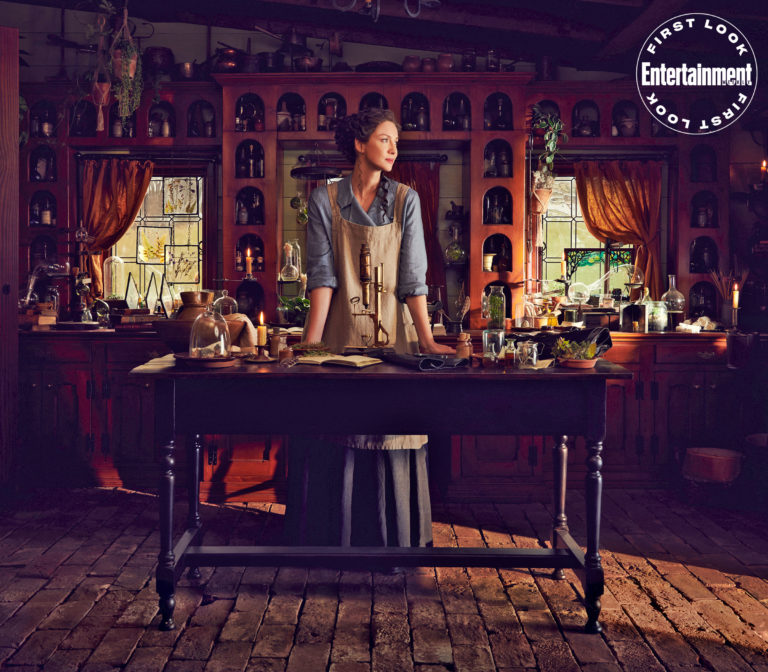
Where is `table`? Image resolution: width=768 pixels, height=672 pixels. table is located at coordinates (385, 398).